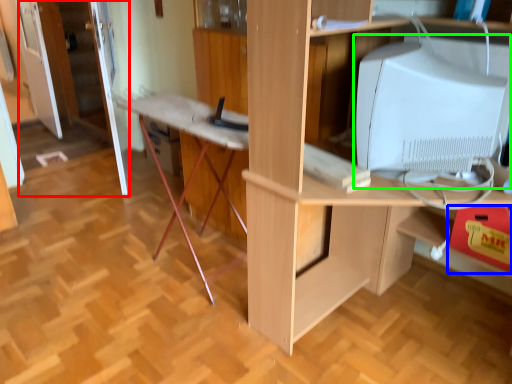
Question: Considering the real-world distances, which object is closest to door (highlighted by a red box)? drawer (highlighted by a blue box) or computer monitor (highlighted by a green box).

Choices:
 (A) drawer
 (B) computer monitor

Answer: (B)